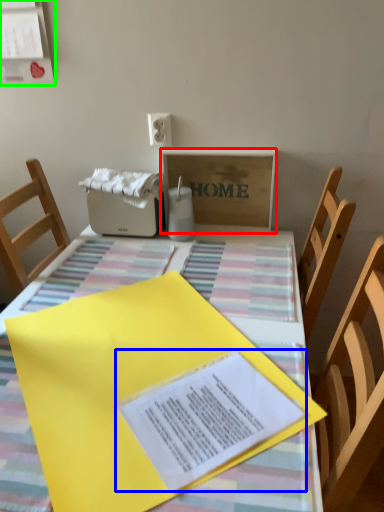
Question: Based on their relative distances, which object is farther from cardboard box (highlighted by a red box)? Choose from journal (highlighted by a blue box) and bulletin board (highlighted by a green box).

Choices:
 (A) journal
 (B) bulletin board

Answer: (A)